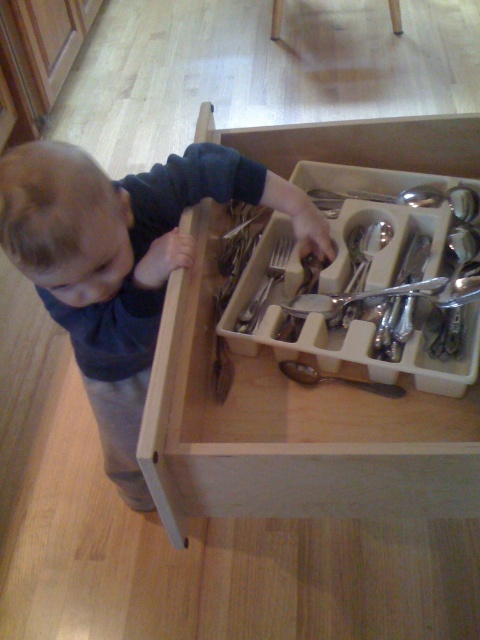
Question: Is satin silver fork at center to the right of matte silver spoon at center from the viewer's perspective?

Choices:
 (A) yes
 (B) no

Answer: (B)

Question: Can you confirm if satin silverware at center is smaller than satin silver fork at center?

Choices:
 (A) yes
 (B) no

Answer: (B)

Question: Does dark blue shirt at center have a larger size compared to satin silverware at center?

Choices:
 (A) yes
 (B) no

Answer: (A)

Question: Which point is farther from the camera taking this photo?

Choices:
 (A) (355, 300)
 (B) (277, 280)
 (C) (396, 182)
 (D) (339, 380)

Answer: (C)

Question: Which point is farther to the camera?

Choices:
 (A) satin silver fork at center
 (B) matte silver spoon at center
 (C) satin silverware at center
 (D) dark blue shirt at center

Answer: (A)

Question: Which is nearer to the satin silver fork at center?

Choices:
 (A) satin silver spoon at center
 (B) satin silverware at center
 (C) dark blue shirt at center
 (D) matte silver spoon at center

Answer: (A)